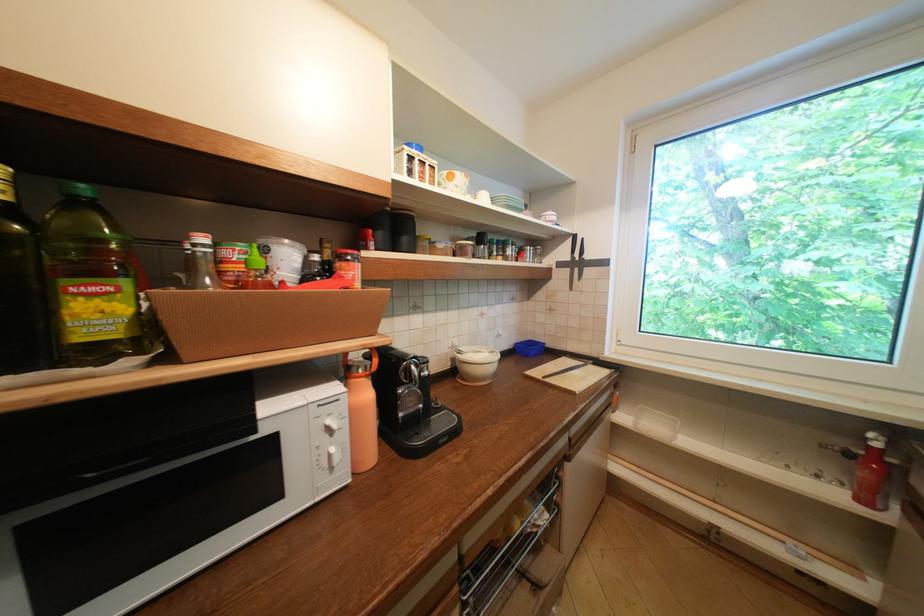
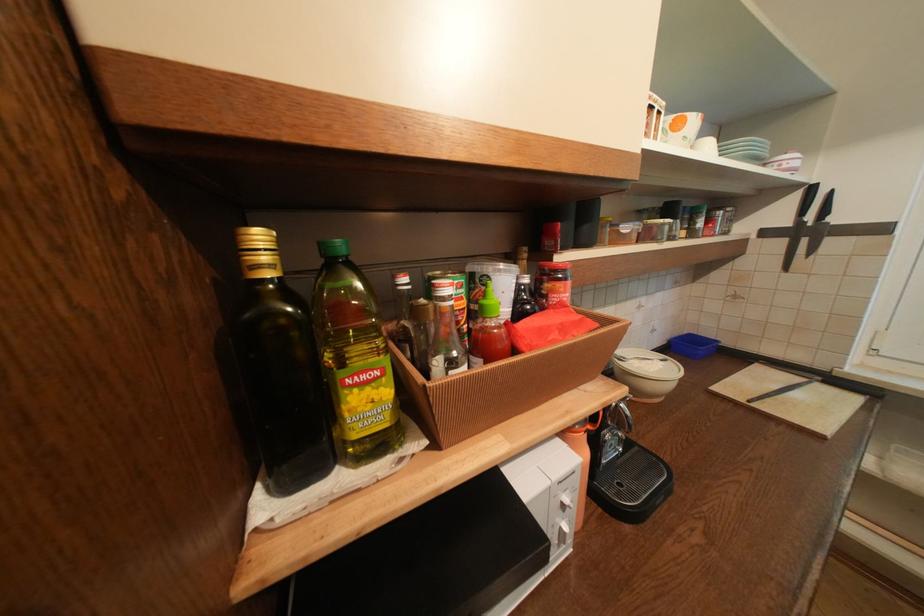
In the second image, find the point that corresponds to [578,241] in the first image.

(807, 196)